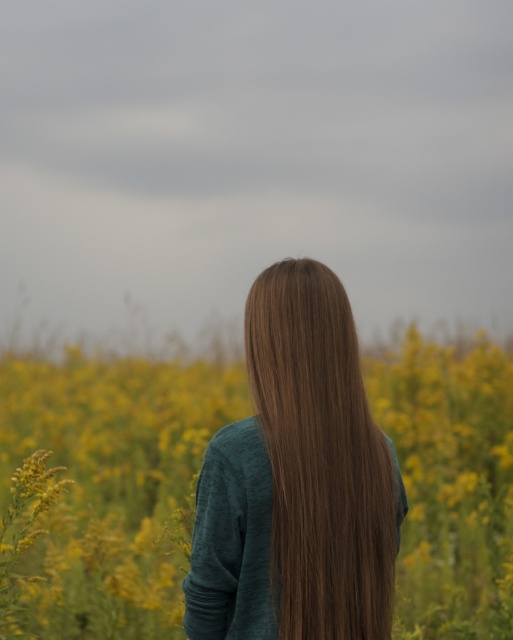
Which is in front, point (388, 353) or point (333, 582)?

Positioned in front is point (333, 582).

Is point (155, 502) positioned after point (271, 353)?

Yes, it is behind point (271, 353).

Locate an element on the screen. This screenshot has height=640, width=513. yellow soft textured flowers at center is located at coordinates (111, 484).